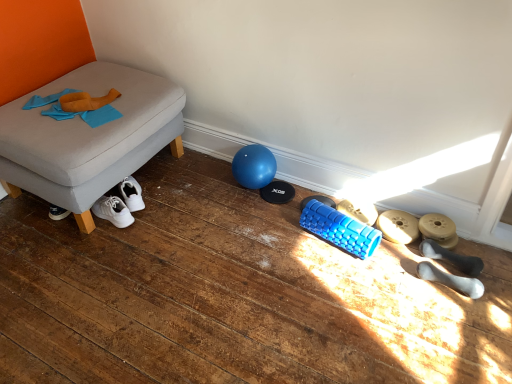
Identify the location of free spot to the left of white rubber dumbbell at lower right, placed as the 5th footwear when sorted from back to front. (402, 290).